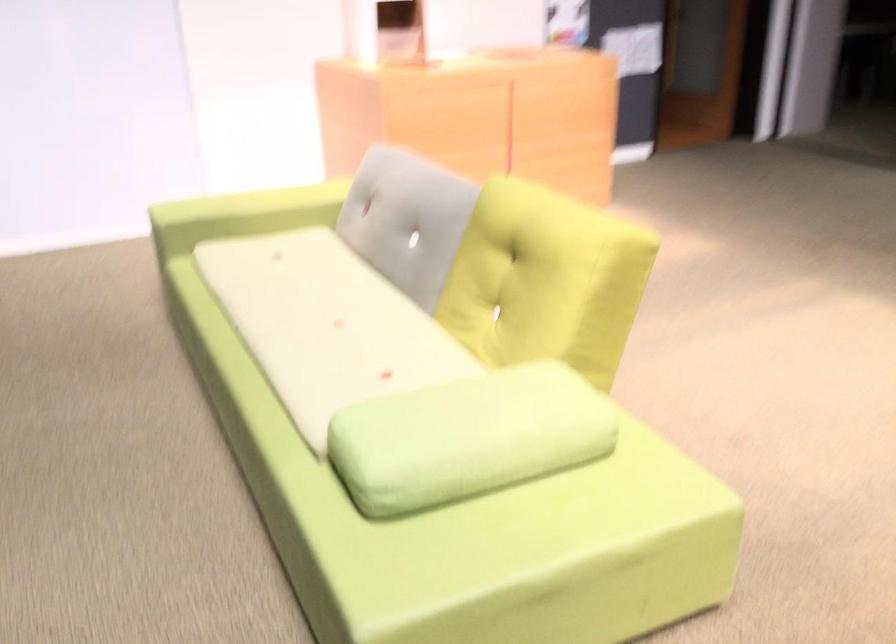
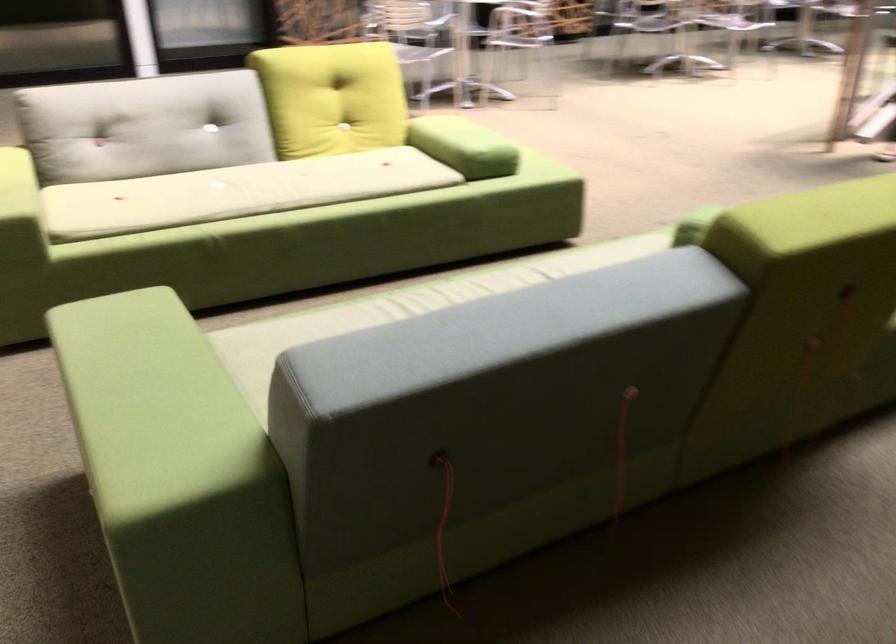
Find the pixel in the second image that matches (x=270, y=295) in the first image.

(236, 192)